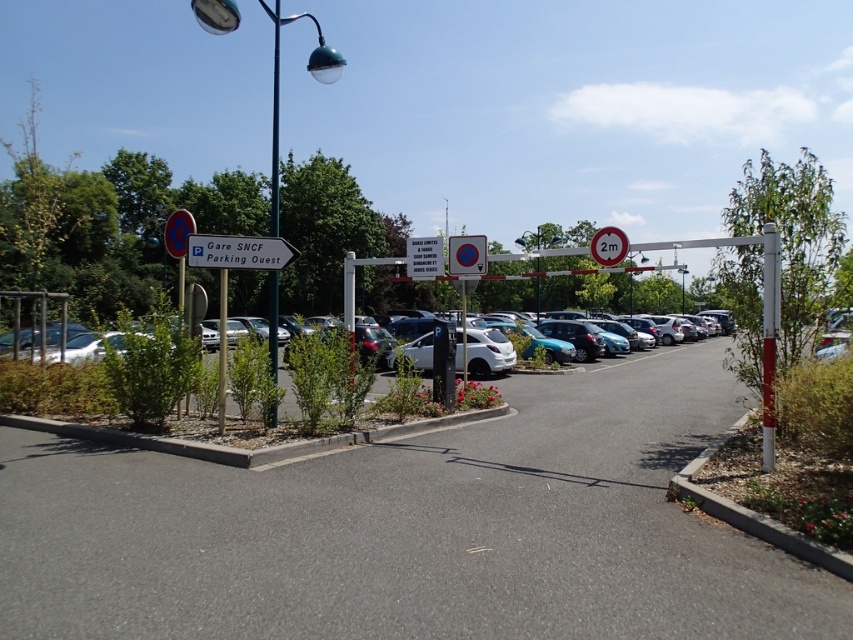
You are driving a truck that is 4 meters long. You need to park in the parking area shown. There is a parking barrier with a red 2m sign and a lamppost on the left side of the road. Can your truck fit between the point at coordinates [566,614] and the parking barrier with a red 2m sign?

The distance between the point at coordinates [566,614] and the parking barrier with a red 2m sign is 4.11 meters. Since your truck is 4 meters long, it can fit between them as there is enough space.

You are a delivery driver approaching the parking area and need to know the location of the asphalt at center relative to the white plastic sign at center. Which object is positioned to the right?

The asphalt at center is to the right of the white plastic sign at center.

You are a delivery driver who needs to park your truck, which is 4 meters long, in the parking area. You see the white matte car at center and the metallic pole at center. Can you safely park your truck between them without hitting the pole?

The white matte car at center is 37.30 meters from the metallic pole at center. Since your truck is only 4 meters long, there is ample space between them to park safely without hitting the pole.